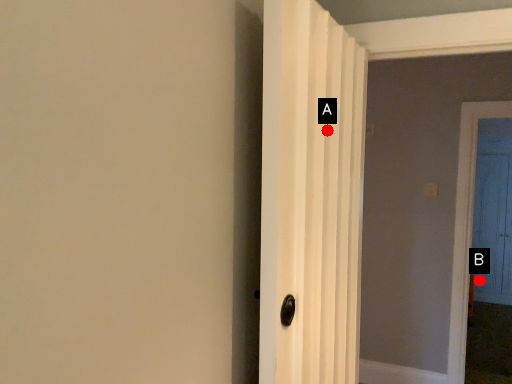
Question: Two points are circled on the image, labeled by A and B beside each circle. Which point appears farthest from the camera in this image?

Choices:
 (A) A is further
 (B) B is further

Answer: (B)